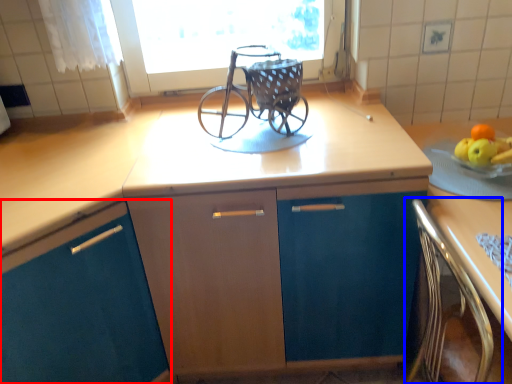
Question: Which of the following is the farthest to the observer, cabinetry (highlighted by a red box) or chair (highlighted by a blue box)?

Choices:
 (A) cabinetry
 (B) chair

Answer: (A)